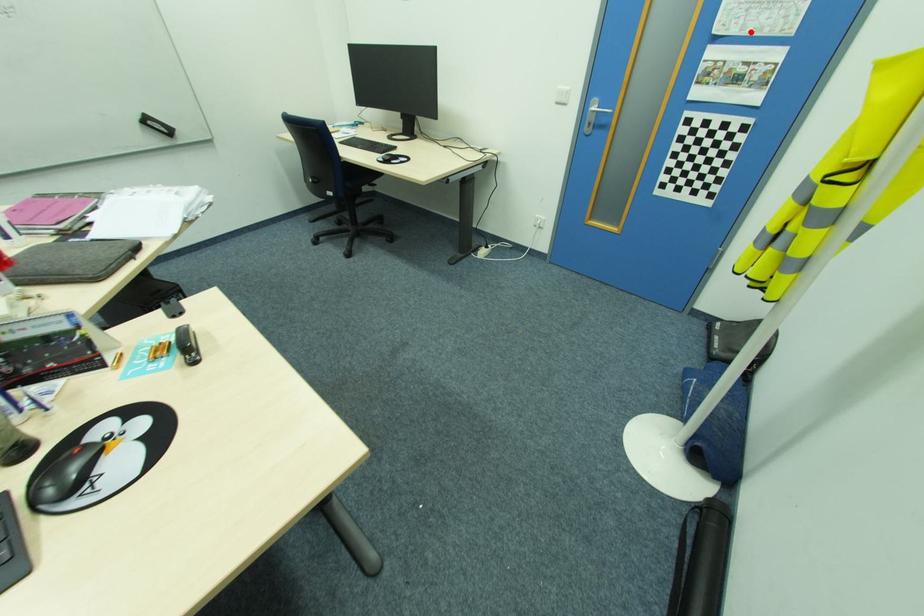
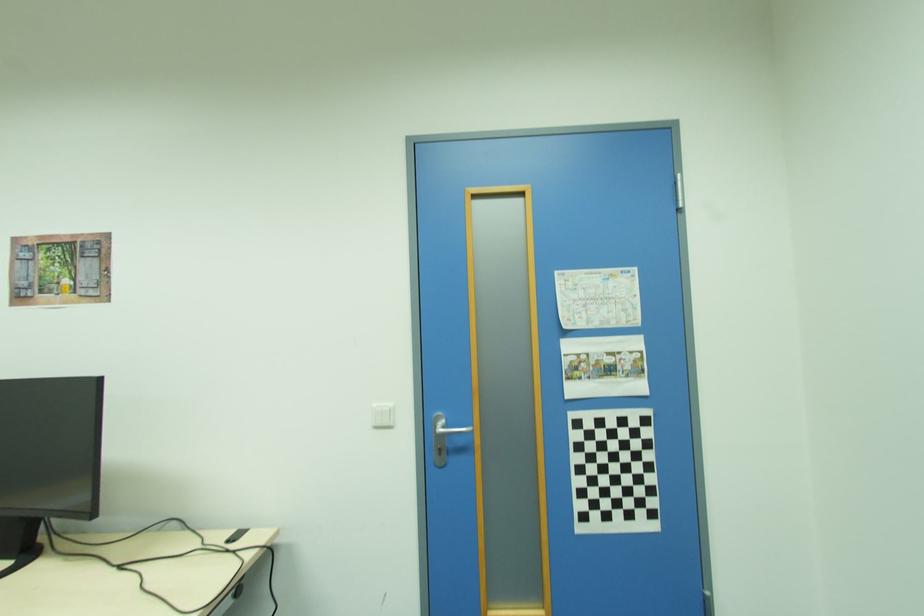
Question: I am providing you with two images of the same scene from different viewpoints. Image1 has a red point marked. In image2, the corresponding 3D location appears at what relative position? Reply with the corresponding letter.

Choices:
 (A) Closer
 (B) Farther

Answer: (A)